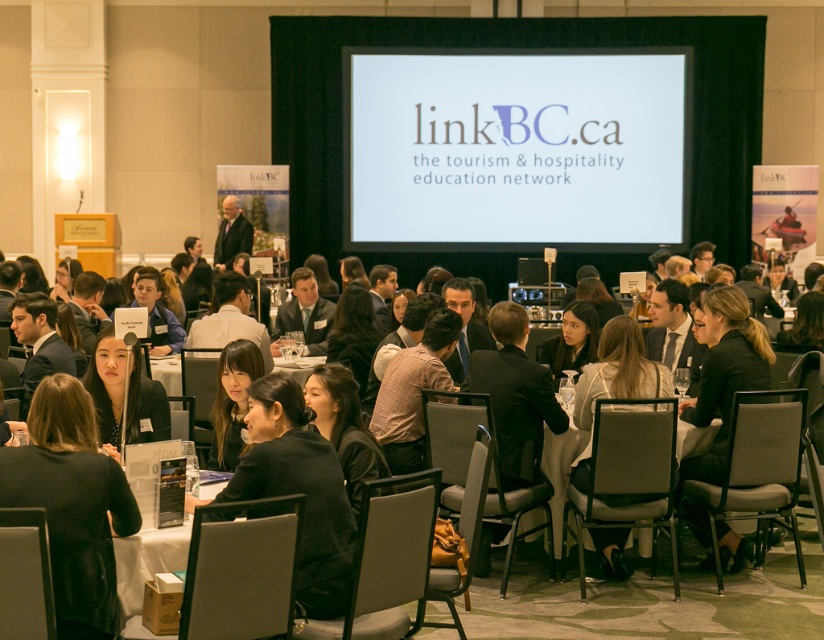
Question: Among these points, which one is farthest from the camera?

Choices:
 (A) (106, 339)
 (B) (398, 106)

Answer: (B)

Question: Is white paper at center smaller than dark suit at center?

Choices:
 (A) no
 (B) yes

Answer: (B)

Question: Is matte black hair at center to the right of white paper at center from the viewer's perspective?

Choices:
 (A) no
 (B) yes

Answer: (A)

Question: Which point is closer to the camera?

Choices:
 (A) black leather jacket at lower right
 (B) checkered shirt at center
 (C) white matte projection screen at center

Answer: (A)

Question: Which of the following is the closest to the observer?

Choices:
 (A) (322, 536)
 (B) (68, 380)

Answer: (B)

Question: Is matte black hair at center above white plastic chair at lower center?

Choices:
 (A) yes
 (B) no

Answer: (A)